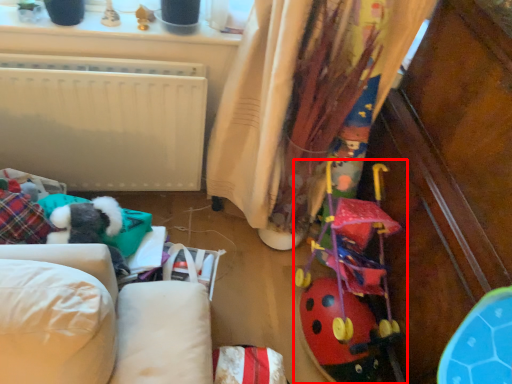
Question: From the image's perspective, where is toy (annotated by the red box) located relative to curtain?

Choices:
 (A) below
 (B) above

Answer: (A)